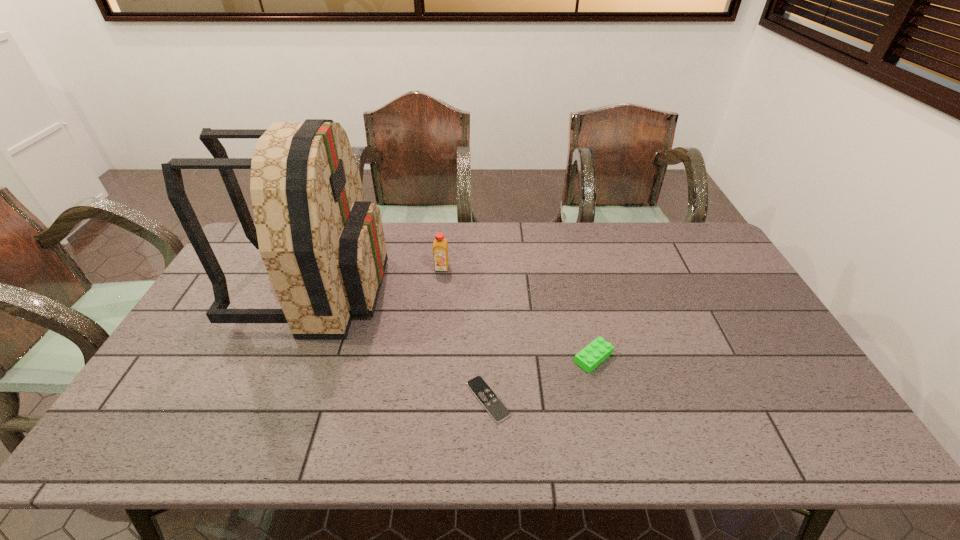
Locate an element on the screen. The image size is (960, 540). vacant space that satisfies the following two spatial constraints: 1. on the front and back of the rightmost object; 2. on the left side of the orange juice is located at coordinates (433, 357).

Image resolution: width=960 pixels, height=540 pixels. I want to click on free spot that satisfies the following two spatial constraints: 1. on the front and back of the third object from right to left; 2. on the right side of the second object from right to left, so click(428, 399).

The image size is (960, 540). I want to click on vacant space that satisfies the following two spatial constraints: 1. on the front face of the backpack; 2. on the back side of the second object from right to left, so click(x=270, y=399).